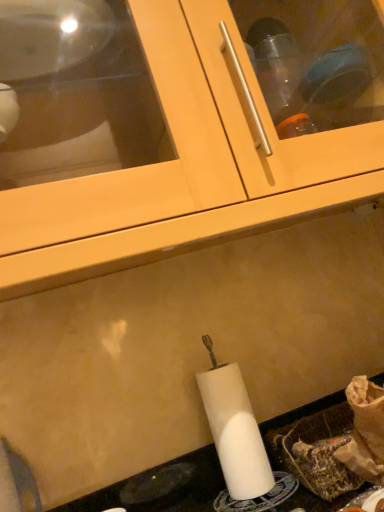
Identify the location of white matte paper towel at lower center. The width and height of the screenshot is (384, 512). (235, 432).

This screenshot has height=512, width=384. What do you see at coordinates (235, 432) in the screenshot? I see `white matte paper towel at lower center` at bounding box center [235, 432].

At what (x,y) coordinates should I click in order to perform the action: click on white matte paper towel at lower center. Please return your answer as a coordinate pair (x, y). The height and width of the screenshot is (512, 384). Looking at the image, I should click on (235, 432).